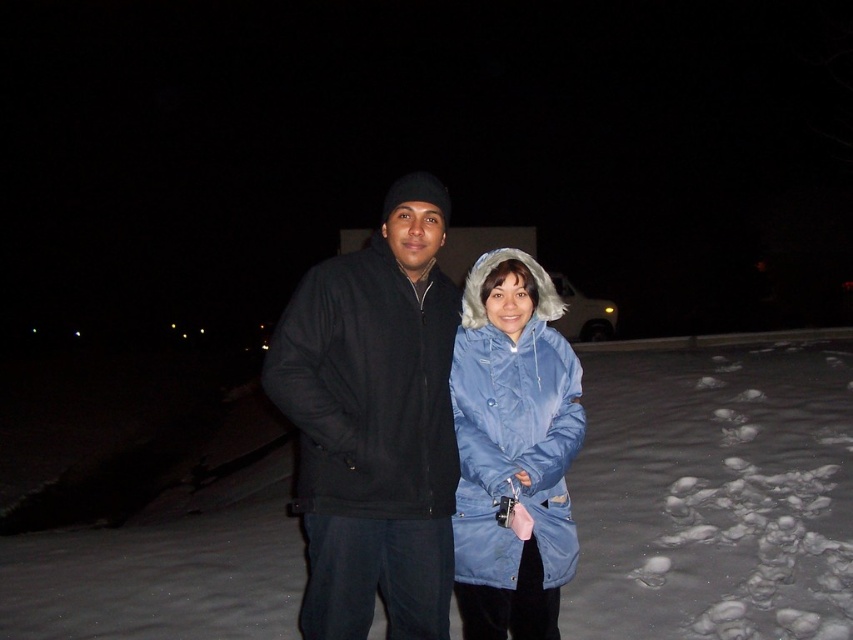
Question: Does matte black jacket at center have a lesser width compared to blue matte coat at center?

Choices:
 (A) yes
 (B) no

Answer: (B)

Question: Is white fluffy snow at center to the left of blue matte coat at center from the viewer's perspective?

Choices:
 (A) yes
 (B) no

Answer: (B)

Question: Can you confirm if white fluffy snow at center is wider than matte black jacket at center?

Choices:
 (A) yes
 (B) no

Answer: (A)

Question: Which of the following is the farthest from the observer?

Choices:
 (A) (563, 483)
 (B) (427, 208)

Answer: (A)

Question: Which of the following is the closest to the observer?

Choices:
 (A) (438, 428)
 (B) (515, 545)

Answer: (B)

Question: Which object appears closest to the camera in this image?

Choices:
 (A) white fluffy snow at center
 (B) blue matte coat at center
 (C) matte black jacket at center

Answer: (C)